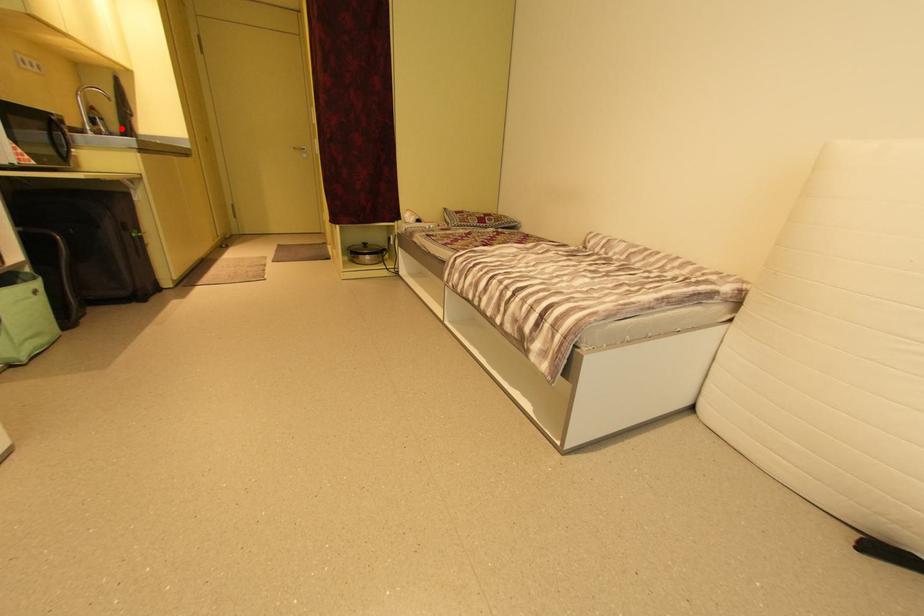
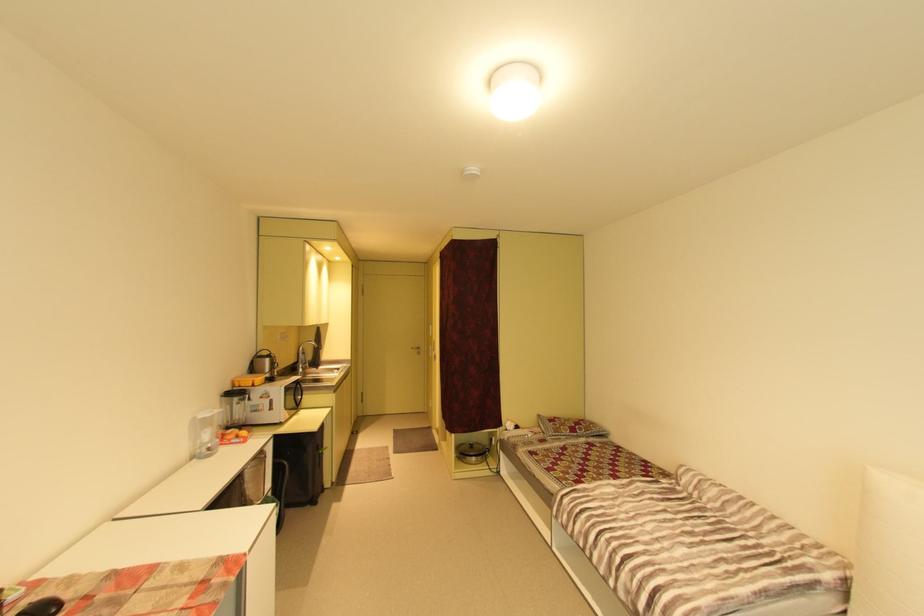
Question: I am providing you with two images of the same scene from different viewpoints. A red point is shown in image1. For the corresponding object point in image2, is it positioned nearer or farther from the camera?

Choices:
 (A) Nearer
 (B) Farther

Answer: (A)